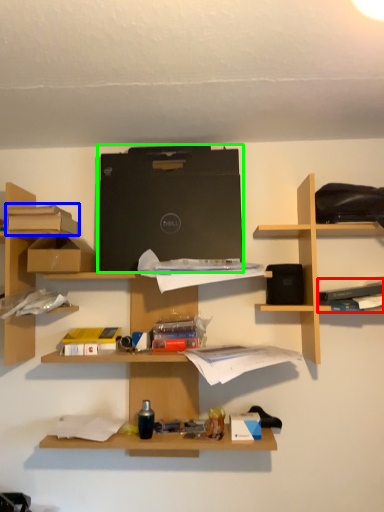
Question: Based on their relative distances, which object is nearer to book (highlighted by a red box)? Choose from book (highlighted by a blue box) and computer (highlighted by a green box).

Choices:
 (A) book
 (B) computer

Answer: (B)